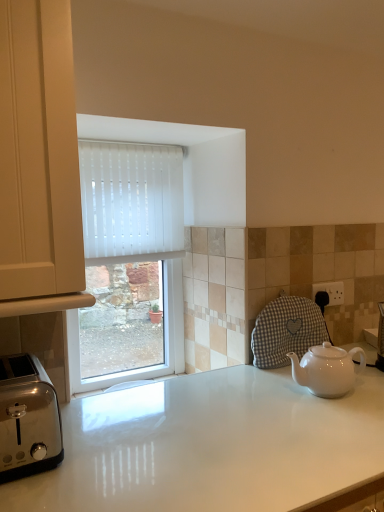
Locate an element on the screen. free space in front of white ceramic teapot at lower right is located at coordinates (339, 419).